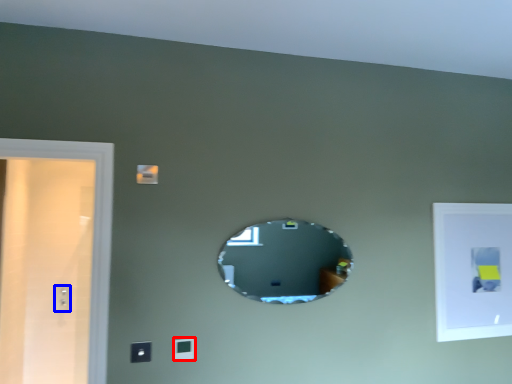
Question: Which object appears closest to the camera in this image, light switch (highlighted by a red box) or electric outlet (highlighted by a blue box)?

Choices:
 (A) light switch
 (B) electric outlet

Answer: (A)